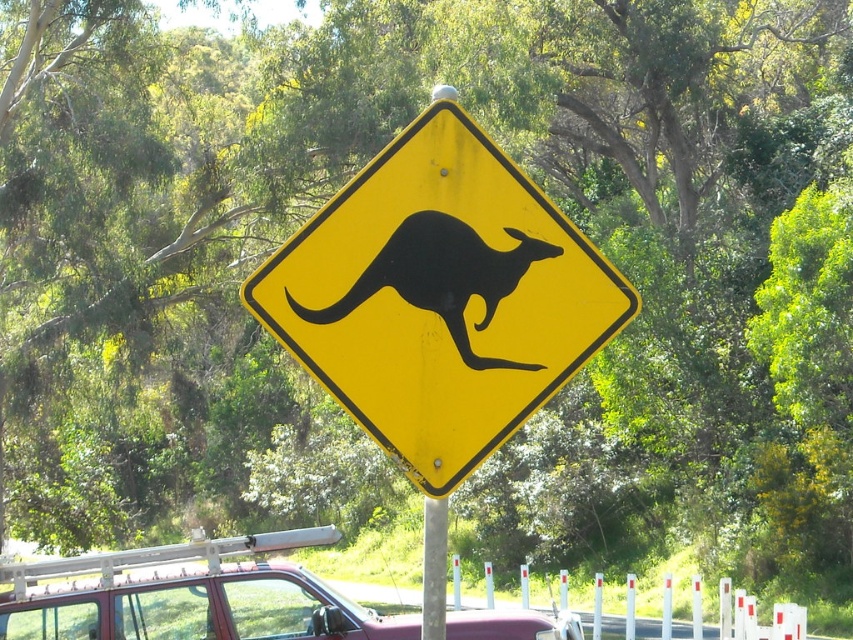
Question: Does yellow matte sign at center appear on the right side of maroon matte car at center?

Choices:
 (A) yes
 (B) no

Answer: (A)

Question: Estimate the real-world distances between objects in this image. Which object is farther from the maroon matte car at center?

Choices:
 (A) yellow matte sign at center
 (B) metallic gray pole at center
 (C) black matte/kangaroo at center

Answer: (C)

Question: Which object appears closest to the camera in this image?

Choices:
 (A) yellow matte sign at center
 (B) metallic gray pole at center
 (C) black matte/kangaroo at center
 (D) maroon matte car at center

Answer: (A)

Question: Is black matte/kangaroo at center above metallic gray pole at center?

Choices:
 (A) no
 (B) yes

Answer: (B)

Question: Which of these objects is positioned farthest from the metallic gray pole at center?

Choices:
 (A) maroon matte car at center
 (B) black matte/kangaroo at center
 (C) yellow matte sign at center

Answer: (A)

Question: Does maroon matte car at center have a lesser width compared to black matte/kangaroo at center?

Choices:
 (A) yes
 (B) no

Answer: (B)